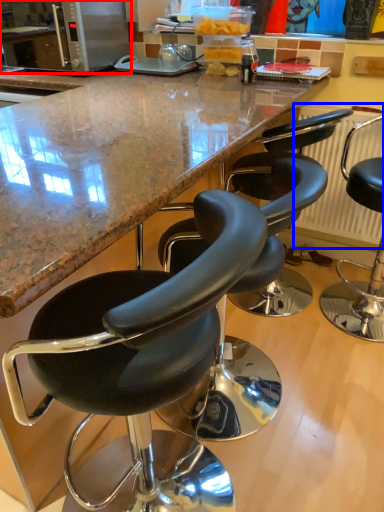
Question: Which point is further to the camera, microwave oven (highlighted by a red box) or radiator (highlighted by a blue box)?

Choices:
 (A) microwave oven
 (B) radiator

Answer: (A)